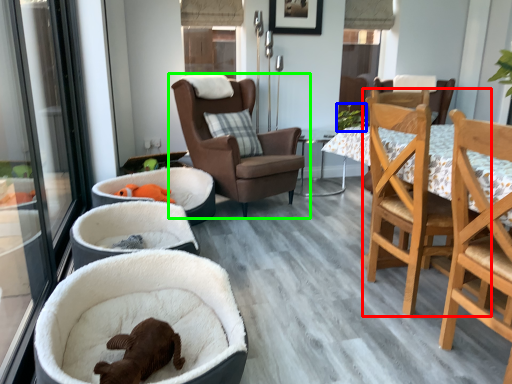
Question: Which object is the farthest from chair (highlighted by a red box)? Choose among these: plant (highlighted by a blue box) or chair (highlighted by a green box).

Choices:
 (A) plant
 (B) chair

Answer: (A)